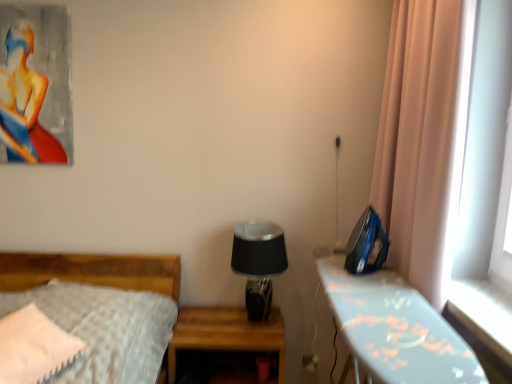
Question: Can you confirm if matte acrylic painting of a woman at upper left is taller than blue plastic iron at right, arranged as the 2th nightstand when viewed from the left?

Choices:
 (A) no
 (B) yes

Answer: (A)

Question: Does matte acrylic painting of a woman at upper left touch blue plastic iron at right, arranged as the 2th nightstand when viewed from the left?

Choices:
 (A) no
 (B) yes

Answer: (A)

Question: Can we say matte acrylic painting of a woman at upper left lies outside blue plastic iron at right, arranged as the 2th nightstand when viewed from the left?

Choices:
 (A) no
 (B) yes

Answer: (B)

Question: From a real-world perspective, is matte acrylic painting of a woman at upper left on top of blue plastic iron at right, which is the first nightstand in right-to-left order?

Choices:
 (A) no
 (B) yes

Answer: (B)

Question: Is matte acrylic painting of a woman at upper left thinner than blue plastic iron at right, which is the first nightstand in right-to-left order?

Choices:
 (A) yes
 (B) no

Answer: (A)

Question: Is wooden nightstand at center, which is the second nightstand in right-to-left order, inside the boundaries of blue plastic iron at right, which is the first nightstand in right-to-left order, or outside?

Choices:
 (A) inside
 (B) outside

Answer: (B)

Question: Looking at their shapes, would you say wooden nightstand at center, which is the second nightstand in right-to-left order, is wider or thinner than blue plastic iron at right, arranged as the 2th nightstand when viewed from the left?

Choices:
 (A) thin
 (B) wide

Answer: (B)

Question: Based on their sizes in the image, would you say wooden nightstand at center, the first nightstand in the left-to-right sequence, is bigger or smaller than blue plastic iron at right, arranged as the 2th nightstand when viewed from the left?

Choices:
 (A) small
 (B) big

Answer: (A)

Question: From a real-world perspective, is wooden nightstand at center, which is the second nightstand in right-to-left order, positioned above or below blue plastic iron at right, which is the first nightstand in right-to-left order?

Choices:
 (A) below
 (B) above

Answer: (A)

Question: Considering the positions of black glass table lamp at center and white plastic electric outlet at lower center in the image, is black glass table lamp at center bigger or smaller than white plastic electric outlet at lower center?

Choices:
 (A) small
 (B) big

Answer: (B)

Question: Is black glass table lamp at center taller or shorter than white plastic electric outlet at lower center?

Choices:
 (A) short
 (B) tall

Answer: (B)

Question: Is black glass table lamp at center in front of or behind white plastic electric outlet at lower center in the image?

Choices:
 (A) behind
 (B) front

Answer: (B)

Question: Is black glass table lamp at center situated inside white plastic electric outlet at lower center or outside?

Choices:
 (A) outside
 (B) inside

Answer: (A)

Question: Looking at the image, does wooden nightstand at center, which is the second nightstand in right-to-left order, seem bigger or smaller compared to matte acrylic painting of a woman at upper left?

Choices:
 (A) small
 (B) big

Answer: (B)

Question: Which is correct: wooden nightstand at center, the first nightstand in the left-to-right sequence, is inside matte acrylic painting of a woman at upper left, or outside of it?

Choices:
 (A) inside
 (B) outside

Answer: (B)